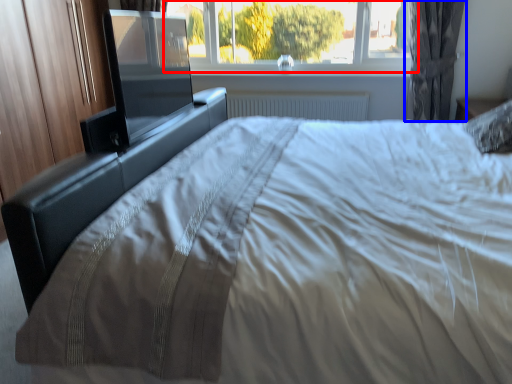
Question: Which object appears closest to the camera in this image, window (highlighted by a red box) or curtain (highlighted by a blue box)?

Choices:
 (A) window
 (B) curtain

Answer: (B)